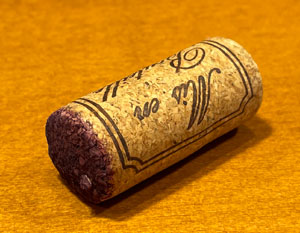
Identify the location of desk. The width and height of the screenshot is (300, 233). (247, 195).